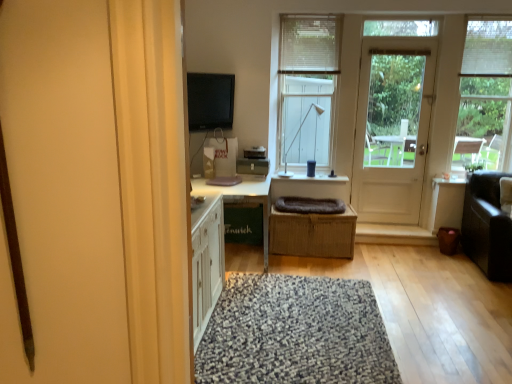
Image resolution: width=512 pixels, height=384 pixels. In order to click on empty space that is ontop of white wooden door at right (from a real-world perspective) in this screenshot , I will do `click(399, 44)`.